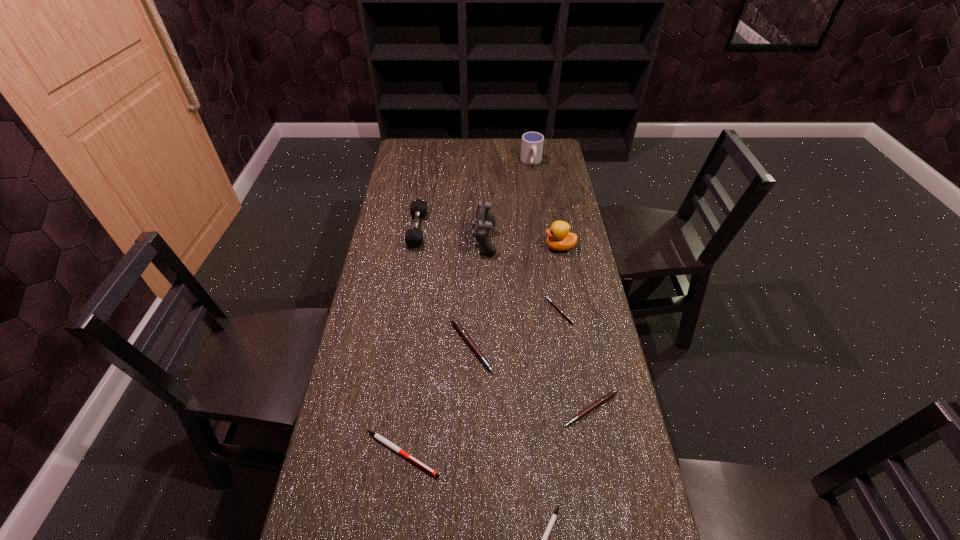
Locate an element on the screen. This screenshot has height=540, width=960. empty location between the control and the fourth tallest object is located at coordinates (451, 234).

Identify the location of object that is the eighth closest one to the farthest object. This screenshot has width=960, height=540. (544, 539).

Choose which object is the fourth nearest neighbor to the leftmost pen. Please provide its 2D coordinates. Your answer should be formatted as a tuple, i.e. [(x, y)], where the tuple contains the x and y coordinates of a point satisfying the conditions above.

[(553, 303)]

The height and width of the screenshot is (540, 960). What are the coordinates of `pen that can be found as the fifth closest to the yellow duckling` in the screenshot? It's located at (544, 539).

Select which pen appears as the closest to the bigger white pen. Please provide its 2D coordinates. Your answer should be formatted as a tuple, i.e. [(x, y)], where the tuple contains the x and y coordinates of a point satisfying the conditions above.

[(459, 328)]

Identify the location of the third closest pink pen to the leftmost pen. This screenshot has width=960, height=540. (553, 303).

The height and width of the screenshot is (540, 960). I want to click on pink pen that stands as the closest to the smallest pink pen, so click(459, 328).

Identify which white pen is located as the second nearest to the yellow duckling. Please provide its 2D coordinates. Your answer should be formatted as a tuple, i.e. [(x, y)], where the tuple contains the x and y coordinates of a point satisfying the conditions above.

[(544, 539)]

The width and height of the screenshot is (960, 540). What are the coordinates of `the second closest white pen to the cup` in the screenshot? It's located at (544, 539).

This screenshot has width=960, height=540. Identify the location of free space that satisfies the following two spatial constraints: 1. with the handle on the side of the farthest object; 2. on the clicker of the bigger white pen. (x=575, y=454).